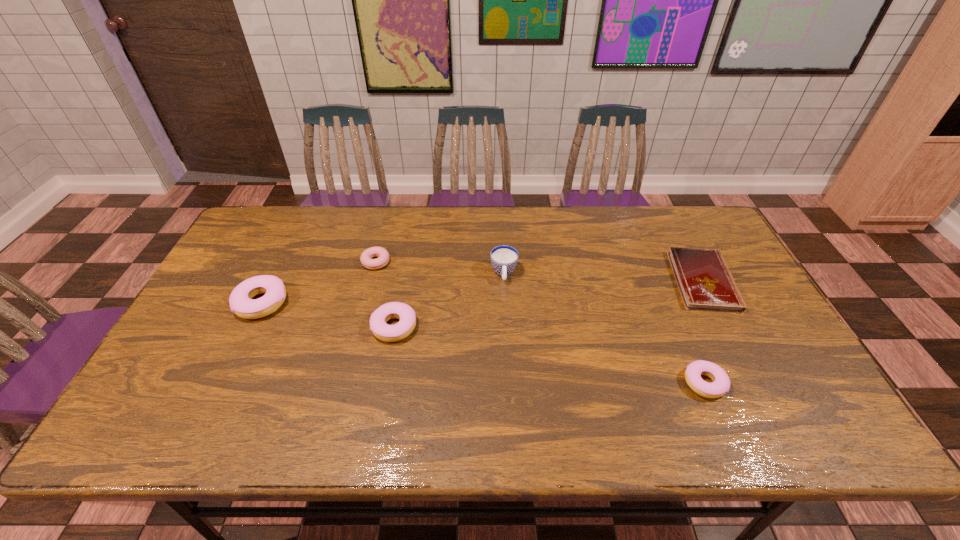
At what (x,y) coordinates should I click in order to perform the action: click on the tallest doughnut. Please return your answer as a coordinate pair (x, y). Looking at the image, I should click on (241, 303).

Where is `the second tallest object`? The image size is (960, 540). the second tallest object is located at coordinates (241, 303).

Where is `the fourth shortest object`? The height and width of the screenshot is (540, 960). the fourth shortest object is located at coordinates (390, 333).

Locate an element on the screen. The height and width of the screenshot is (540, 960). the rightmost doughnut is located at coordinates (720, 386).

At what (x,y) coordinates should I click in order to perform the action: click on the nearest doughnut. Please return your answer as a coordinate pair (x, y). Image resolution: width=960 pixels, height=540 pixels. Looking at the image, I should click on (720, 386).

The width and height of the screenshot is (960, 540). In order to click on the farthest doughnut in this screenshot , I will do `click(383, 256)`.

In order to click on the shortest object in this screenshot , I will do `click(704, 280)`.

The image size is (960, 540). Find the location of `the fourth object from left to right`. the fourth object from left to right is located at coordinates (504, 258).

This screenshot has width=960, height=540. In order to click on cup in this screenshot , I will do tap(504, 258).

Find the location of a particular element. The image size is (960, 540). vacant region located 0.060m on the left of the leftmost object is located at coordinates (215, 303).